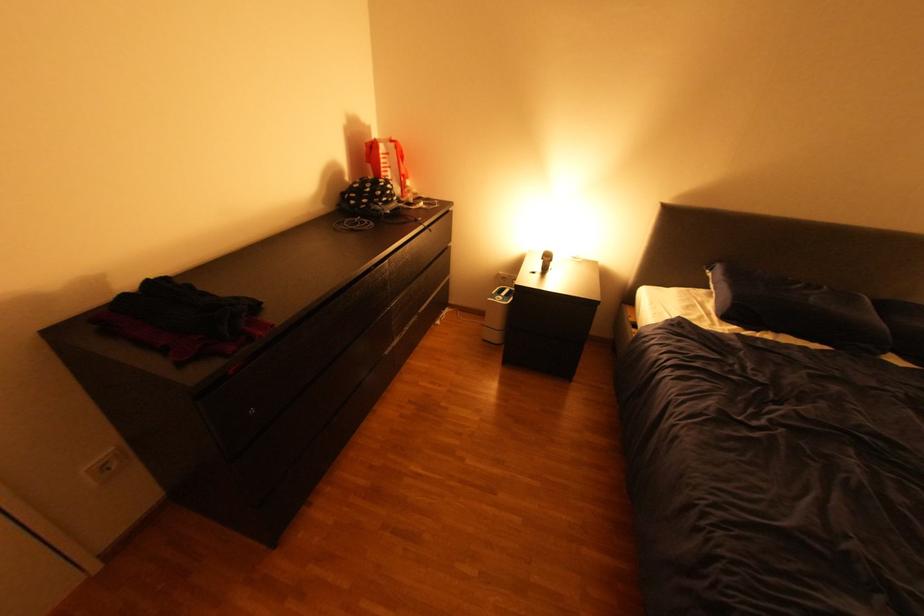
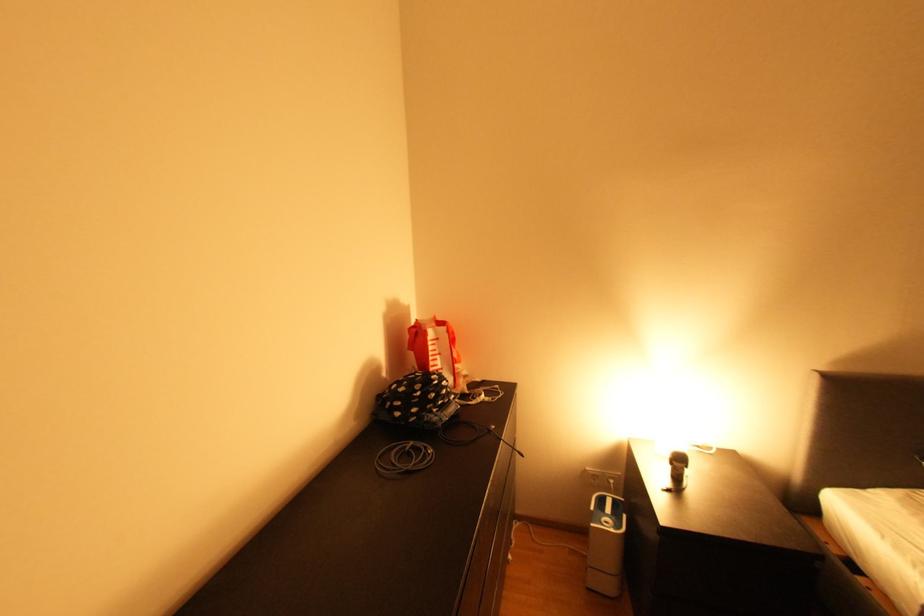
What movement of the cameraman would produce the second image?

The cameraman walked toward left, forward.